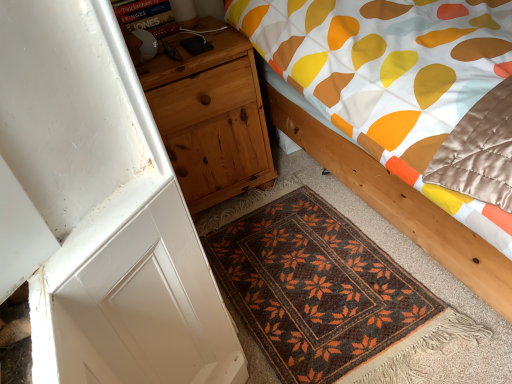
Question: Based on their sizes in the image, would you say brown woven mat at lower center is bigger or smaller than natural wood nightstand at left?

Choices:
 (A) big
 (B) small

Answer: (B)

Question: From their relative heights in the image, would you say brown woven mat at lower center is taller or shorter than natural wood nightstand at left?

Choices:
 (A) tall
 (B) short

Answer: (B)

Question: Considering the real-world distances, which object is farthest from the brown woven mat at lower center?

Choices:
 (A) wooden bed at center
 (B) natural wood nightstand at left

Answer: (B)

Question: Which object is the closest to the wooden bed at center?

Choices:
 (A) brown woven mat at lower center
 (B) natural wood nightstand at left

Answer: (B)